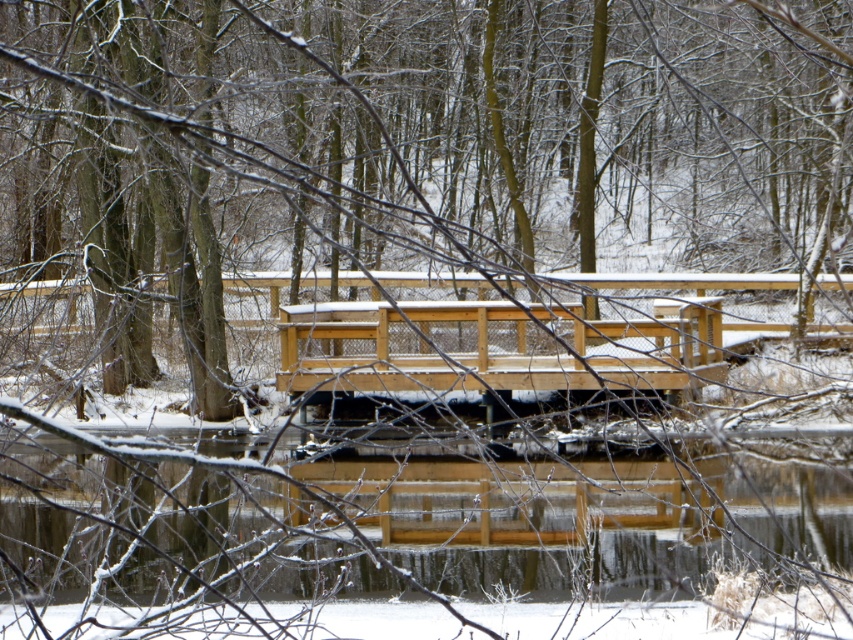
Is clear water at center further to camera compared to natural wood bridge at center?

No, it is not.

Looking at this image, is clear water at center closer to camera compared to natural wood bridge at center?

Yes, clear water at center is closer to the viewer.

I want to click on clear water at center, so click(405, 524).

This screenshot has width=853, height=640. I want to click on clear water at center, so click(x=405, y=524).